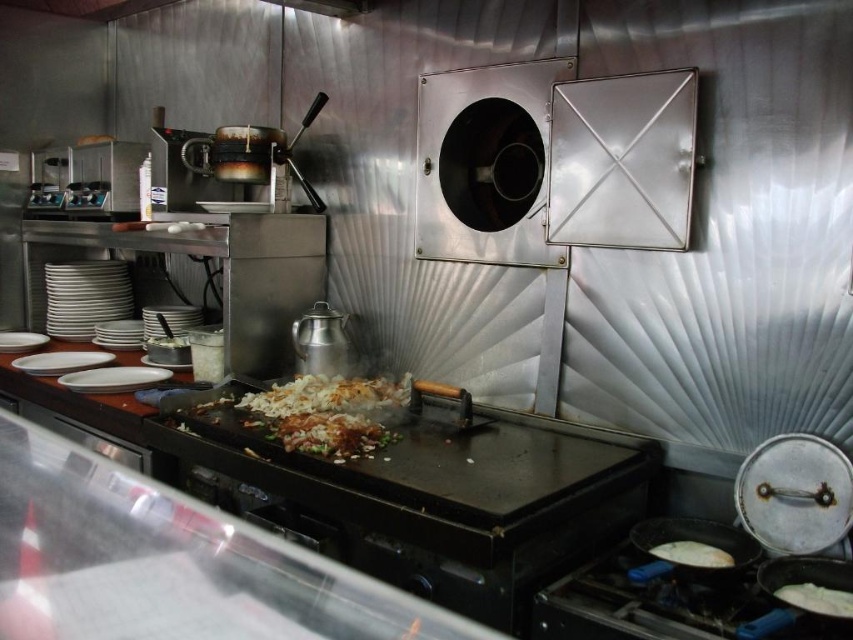
You are a cook in a busy kitchen and need to move a spatula from the black matte griddle at center to the white fluffy pancake at lower right. Which direction should you move the spatula?

You should move the spatula to the right, since the white fluffy pancake at lower right is to the right of the black matte griddle at center.

You are standing in the commercial kitchen and need to reach both the point at coordinates point (316, 388) and the point at coordinates point (53, 369). Which point is closer to you?

Point (316, 388) is in front of point (53, 369), so it is closer to you.

You are a chef working in this commercial kitchen and need to place a new spice rack. The ideal location should be near the cooking area but not directly over the black matte griddle at center to avoid heat interference. Where would you position it?

The black matte griddle at center is located at point (434,497), so the spice rack should be placed near the cooking area but positioned away from the coordinates of the griddle to avoid heat interference.